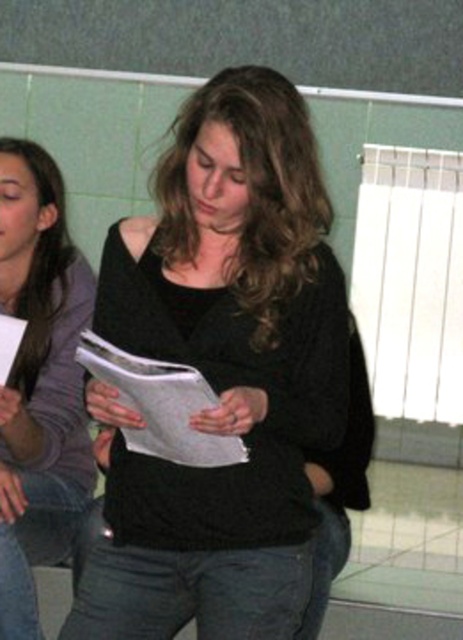
Question: Which of these objects is positioned farthest from the white paper at center?

Choices:
 (A) matte black sweater at center
 (B) black matte sweater at center

Answer: (A)

Question: Which point is farther from the camera taking this photo?

Choices:
 (A) (30, 593)
 (B) (136, 396)

Answer: (A)

Question: Is the position of black matte sweater at center less distant than that of matte black sweater at center?

Choices:
 (A) yes
 (B) no

Answer: (A)

Question: In this image, where is black matte sweater at center located relative to white paper at center?

Choices:
 (A) above
 (B) below

Answer: (A)

Question: Is the position of black matte sweater at center less distant than that of matte black sweater at center?

Choices:
 (A) no
 (B) yes

Answer: (B)

Question: Which point is closer to the camera?

Choices:
 (A) black matte sweater at center
 (B) white paper at center

Answer: (B)